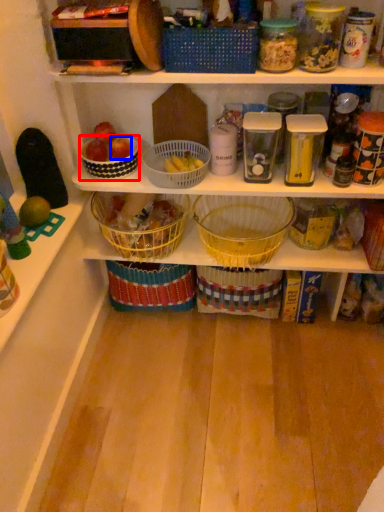
Question: Which object is further to the camera taking this photo, bowl (highlighted by a red box) or apple (highlighted by a blue box)?

Choices:
 (A) bowl
 (B) apple

Answer: (B)